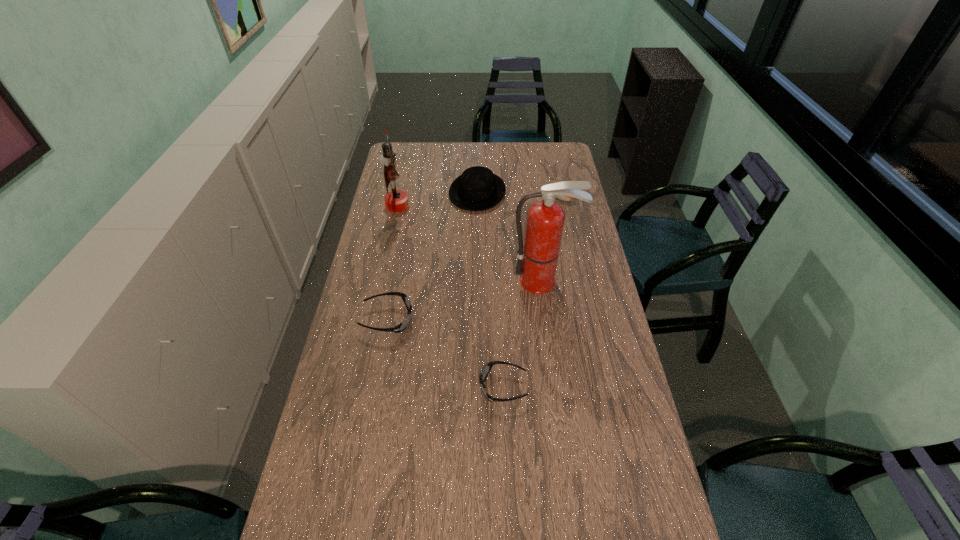
Where is `the taller sunglasses`? This screenshot has height=540, width=960. the taller sunglasses is located at coordinates (403, 325).

I want to click on the farther sunglasses, so click(x=403, y=325).

The image size is (960, 540). I want to click on the nearer sunglasses, so click(489, 366).

At what (x,y) coordinates should I click in order to perform the action: click on the right sunglasses. Please return your answer as a coordinate pair (x, y). The height and width of the screenshot is (540, 960). Looking at the image, I should click on (489, 366).

At what (x,y) coordinates should I click in order to perform the action: click on nutcracker. Please return your answer as a coordinate pair (x, y). The width and height of the screenshot is (960, 540). Looking at the image, I should click on (396, 201).

Locate an element on the screen. Image resolution: width=960 pixels, height=540 pixels. sushi is located at coordinates (561, 197).

Locate an element on the screen. fedora is located at coordinates (477, 188).

This screenshot has width=960, height=540. In order to click on fire extinguisher in this screenshot , I will do `click(537, 261)`.

Locate an element on the screen. The image size is (960, 540). free region located 0.090m on the lenses of the taller sunglasses is located at coordinates (440, 319).

Where is `vacant space situated on the lenses of the shorter sunglasses`? The width and height of the screenshot is (960, 540). vacant space situated on the lenses of the shorter sunglasses is located at coordinates 449,387.